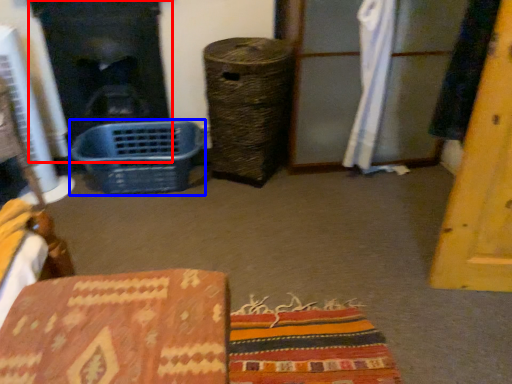
Question: Which object is further to the camera taking this photo, fireplace (highlighted by a red box) or basket (highlighted by a blue box)?

Choices:
 (A) fireplace
 (B) basket

Answer: (A)